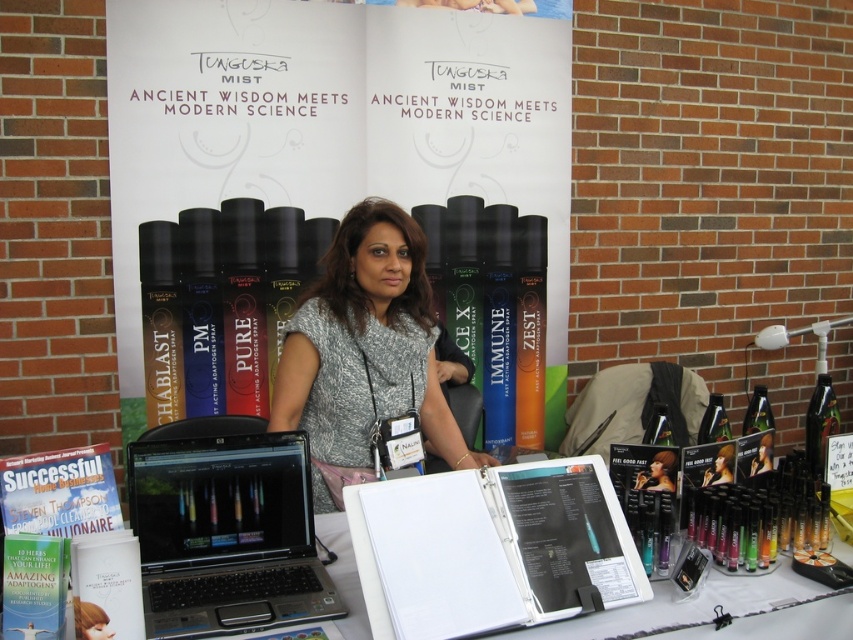
Is black plastic laptop at center shorter than matte black hair at center?

No.

This screenshot has width=853, height=640. What are the coordinates of `black plastic laptop at center` in the screenshot? It's located at (225, 534).

Which is in front, point (271, 541) or point (665, 486)?

Point (271, 541) is more forward.

Locate an element on the screen. Image resolution: width=853 pixels, height=640 pixels. black plastic laptop at center is located at coordinates (225, 534).

Who is shorter, white paper at center or matte silver hair spray at center?

matte silver hair spray at center

Is white paper at center taller than matte silver hair spray at center?

Yes, white paper at center is taller than matte silver hair spray at center.

The width and height of the screenshot is (853, 640). What do you see at coordinates (700, 609) in the screenshot?
I see `white paper at center` at bounding box center [700, 609].

Locate an element on the screen. white paper at center is located at coordinates (700, 609).

Is matte gray blouse at center closer to camera compared to white paper at center?

That is False.

Can you confirm if matte gray blouse at center is thinner than white paper at center?

Indeed, matte gray blouse at center has a lesser width compared to white paper at center.

Which is behind, point (386, 337) or point (332, 541)?

Positioned behind is point (386, 337).

Locate an element on the screen. matte gray blouse at center is located at coordinates (364, 353).